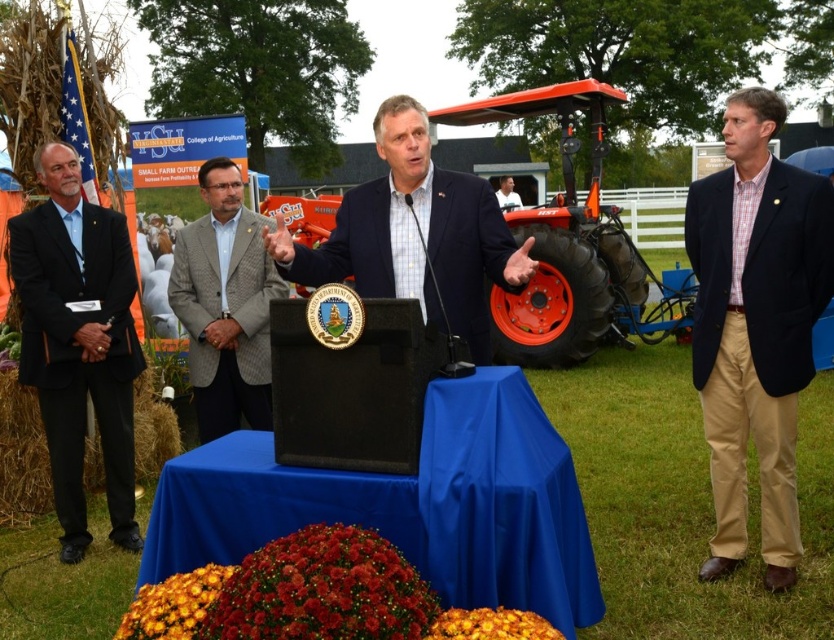
Question: Does dark blue suit at left have a smaller size compared to matte blue suit at center?

Choices:
 (A) yes
 (B) no

Answer: (A)

Question: Among these objects, which one is nearest to the camera?

Choices:
 (A) dark blue suit at left
 (B) plaid shirt at center

Answer: (B)

Question: Can you confirm if dark blue suit at left is positioned to the right of matte blue suit at center?

Choices:
 (A) no
 (B) yes

Answer: (A)

Question: Which object is positioned closest to the blue fabric tablecloth at center?

Choices:
 (A) plaid shirt at center
 (B) white shirt at center

Answer: (A)

Question: Is blue fabric tablecloth at center thinner than gray wool blazer at center?

Choices:
 (A) yes
 (B) no

Answer: (B)

Question: Which object appears farthest from the camera in this image?

Choices:
 (A) matte blue suit at center
 (B) dark blue suit at left
 (C) white shirt at center
 (D) blue fabric tablecloth at center

Answer: (C)